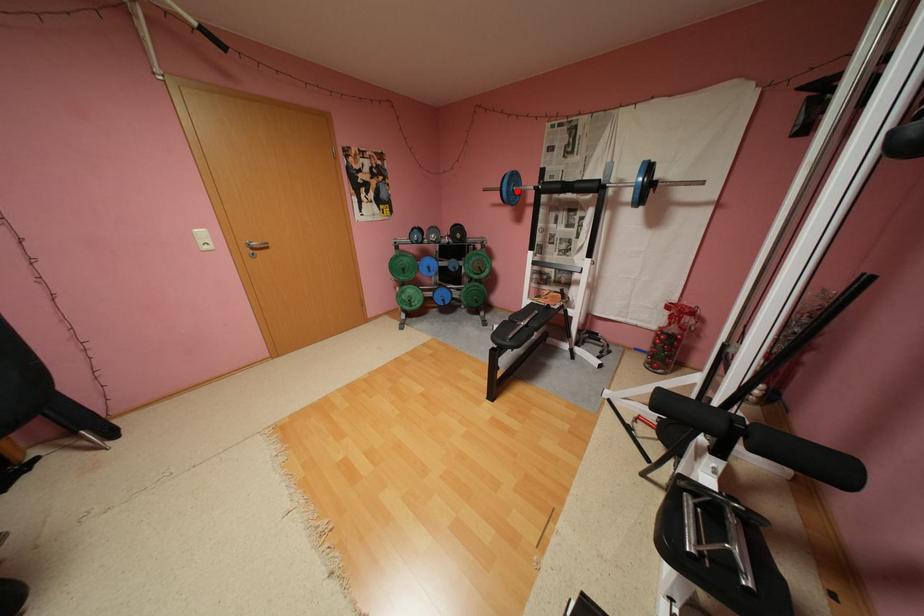
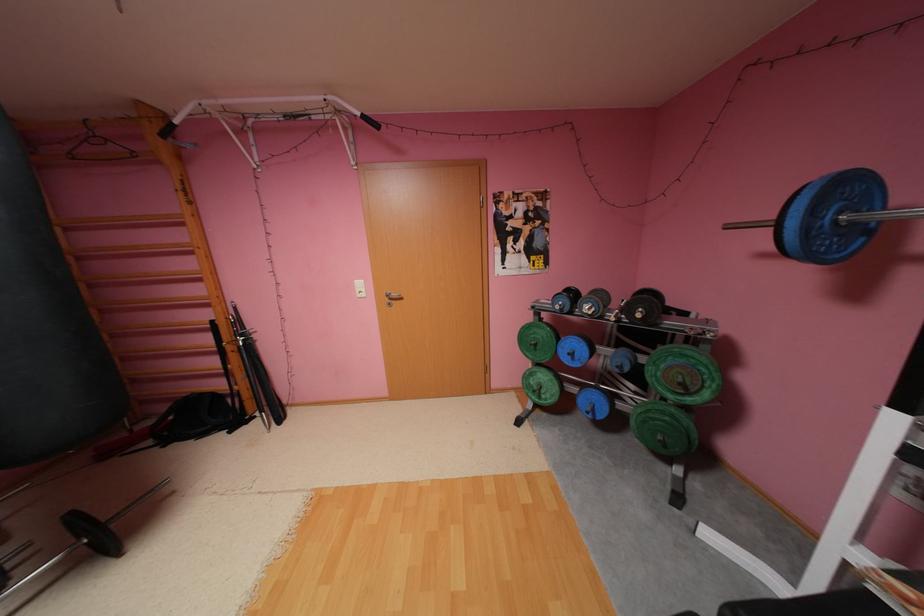
Locate, in the second image, the point that corresponds to the highlighted location in the first image.

(816, 229)